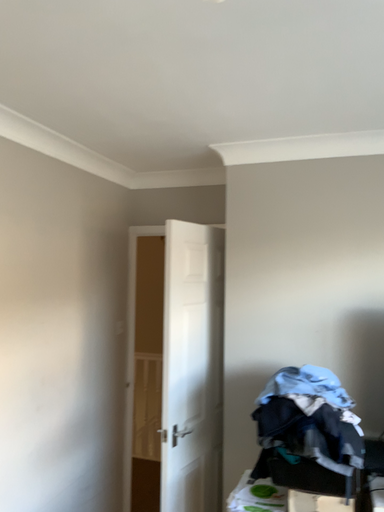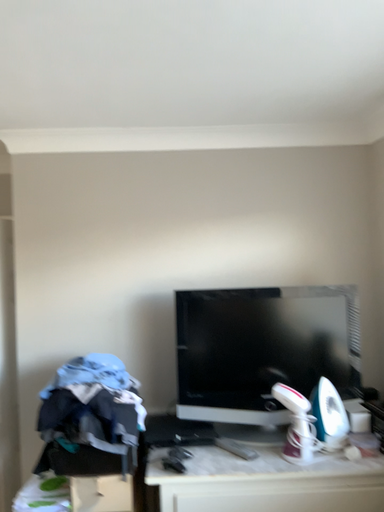
Question: How did the camera likely rotate when shooting the video?

Choices:
 (A) rotated left
 (B) rotated right

Answer: (B)